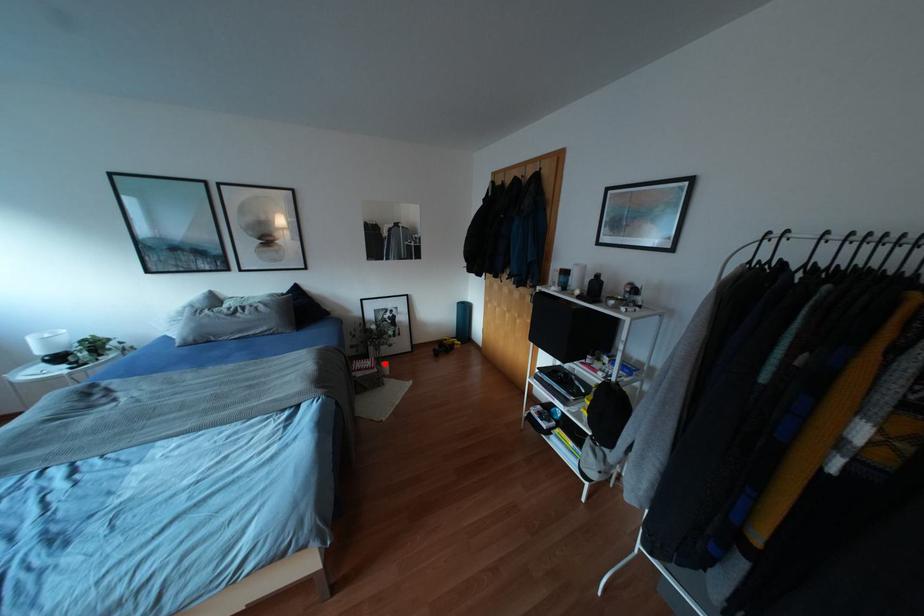
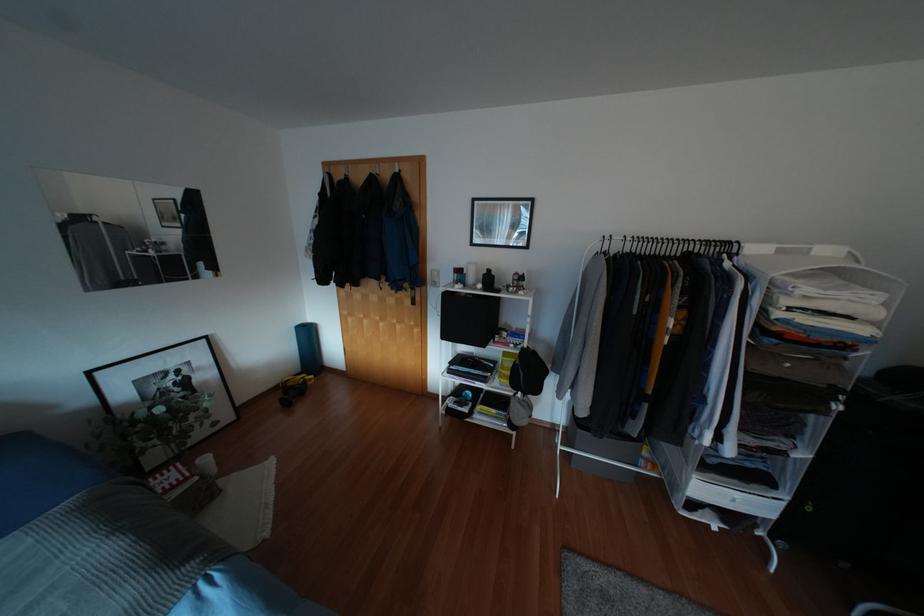
Question: I am providing you with two images of the same scene from different viewpoints. Image1 has a red point marked. In image2, the corresponding 3D location appears at what relative position? Reply with the corresponding letter.

Choices:
 (A) Closer
 (B) Farther

Answer: (B)